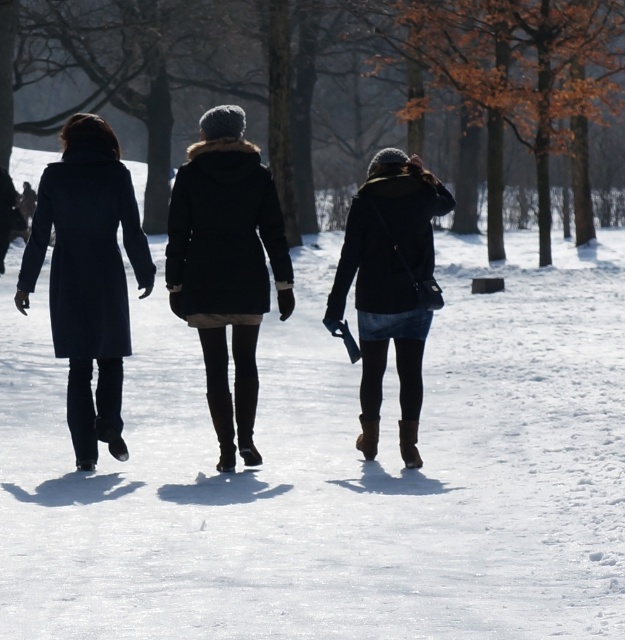
Question: Is matte black coat at left positioned behind matte black jacket at center?

Choices:
 (A) yes
 (B) no

Answer: (B)

Question: Which object appears farthest from the camera in this image?

Choices:
 (A) matte black coat at left
 (B) matte black jacket at center
 (C) matte black coat at center

Answer: (B)

Question: Which object appears closest to the camera in this image?

Choices:
 (A) matte black jacket at center
 (B) matte black coat at left
 (C) matte black coat at center

Answer: (B)

Question: Is matte black coat at center to the left of matte black coat at left from the viewer's perspective?

Choices:
 (A) no
 (B) yes

Answer: (A)

Question: Which of these objects is positioned farthest from the matte black coat at left?

Choices:
 (A) matte black coat at center
 (B) matte black jacket at center

Answer: (B)

Question: Is matte black coat at center positioned at the back of matte black coat at left?

Choices:
 (A) yes
 (B) no

Answer: (A)